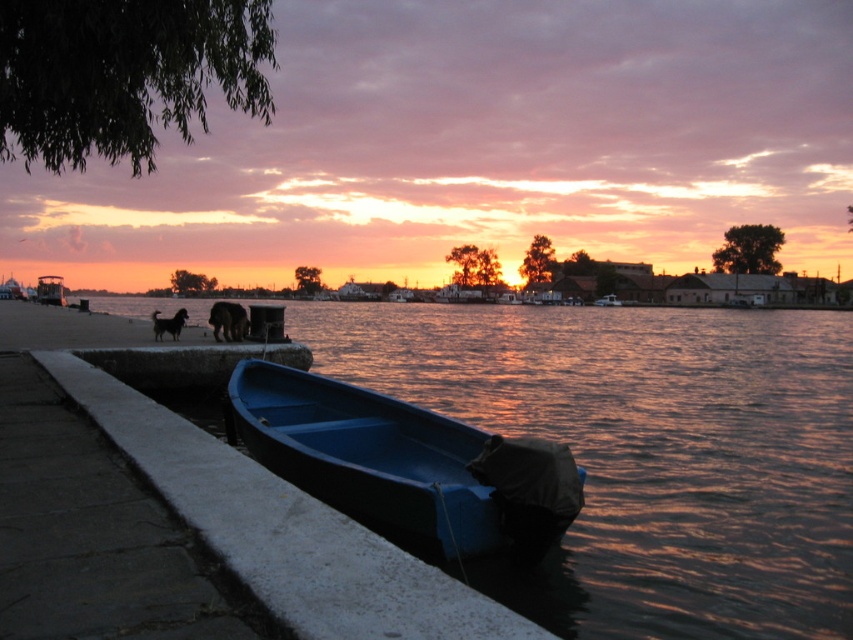
You are a painter who wants to place a small easel between the smooth concrete ledge at lower left and the blue plastic canoe at lower left. Which object should you position the easel closer to so that it doesn

The smooth concrete ledge at lower left is larger in size than the blue plastic canoe at lower left. Therefore, positioning the easel closer to the blue plastic canoe at lower left would leave more space for the larger ledge.

Consider the image. You are standing at the edge of the waterfront and want to place both the smooth concrete ledge at lower left and the blue plastic canoe at lower left side by side. Based on their sizes, which object should be placed first to ensure they fit properly?

The smooth concrete ledge at lower left is wider than the blue plastic canoe at lower left, so you should place the wider smooth concrete ledge at lower left first to ensure they fit properly.

You are a painter setting up your easel to capture the sunset scene. You have to choose between placing your easel on the smooth concrete ledge at lower left or the blue plastic canoe at lower left. Which surface is higher and more stable for your equipment?

The smooth concrete ledge at lower left is taller than the blue plastic canoe at lower left, making it the higher and more stable surface for your equipment.